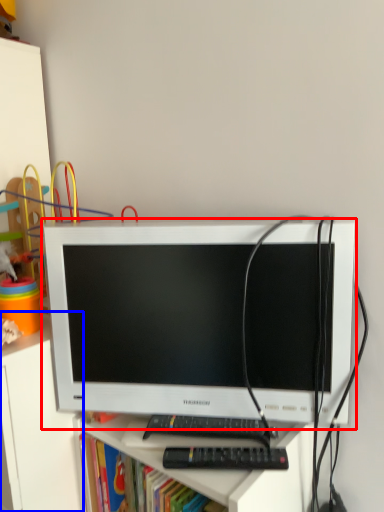
Question: Which object appears farthest to the camera in this image, computer monitor (highlighted by a red box) or file cabinet (highlighted by a blue box)?

Choices:
 (A) computer monitor
 (B) file cabinet

Answer: (B)